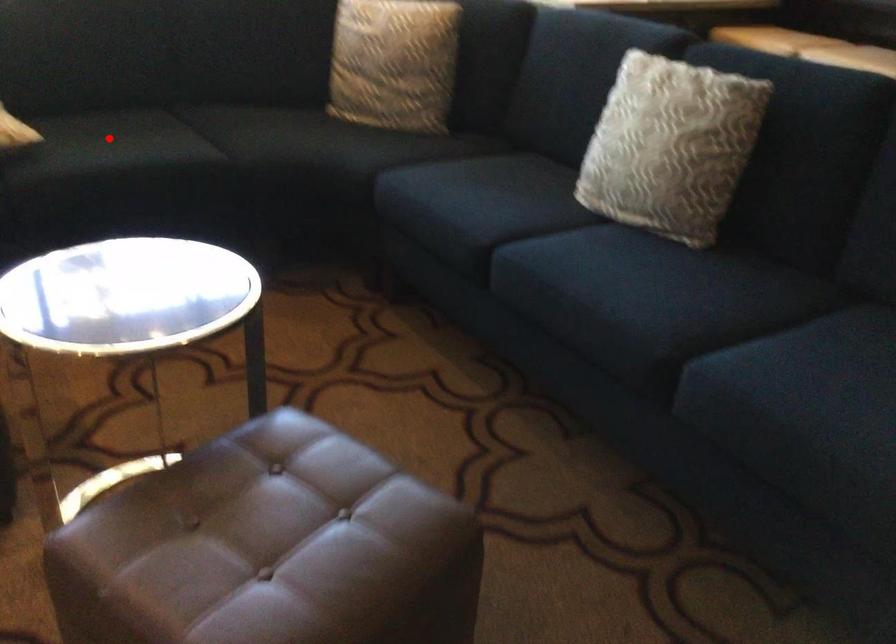
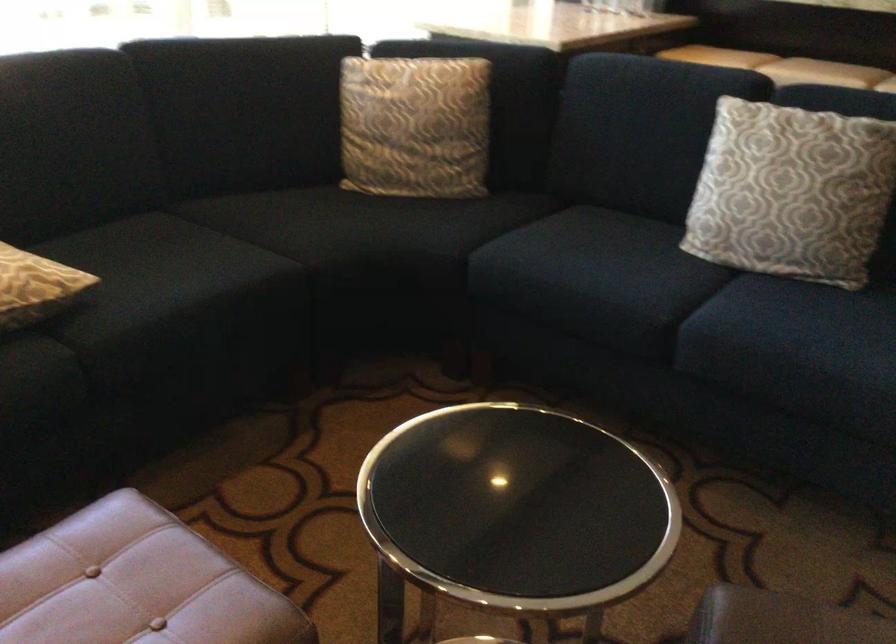
Question: I am providing you with two images of the same scene from different viewpoints. A red point is shown in image1. For the corresponding object point in image2, is it positioned nearer or farther from the camera?

Choices:
 (A) Nearer
 (B) Farther

Answer: (A)